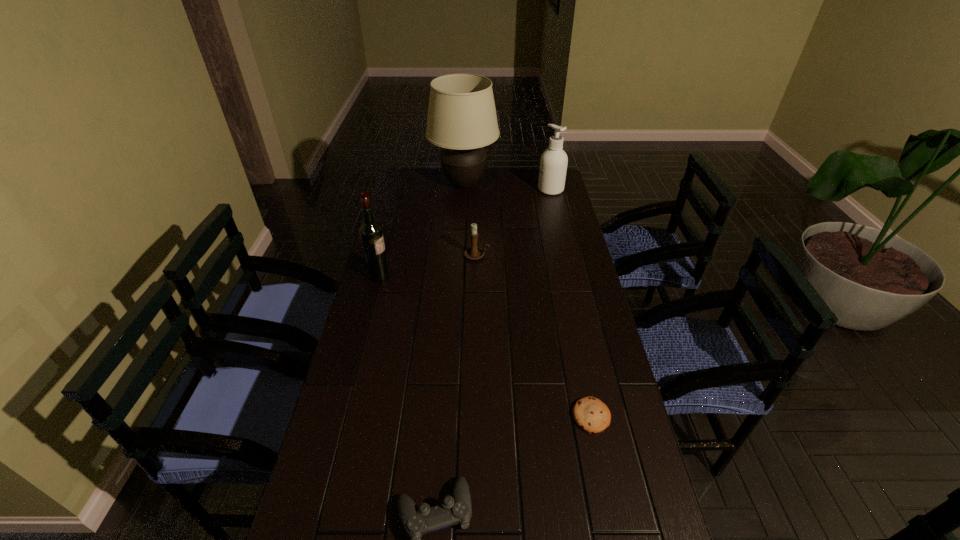
This screenshot has height=540, width=960. I want to click on the tallest object, so click(x=462, y=119).

Image resolution: width=960 pixels, height=540 pixels. Identify the location of the leftmost object. (371, 234).

Locate an element on the screen. wine bottle is located at coordinates (371, 234).

The image size is (960, 540). In order to click on cleansing agent in this screenshot , I will do `click(553, 165)`.

I want to click on the fourth nearest object, so click(473, 252).

Identify the location of the fourth tallest object. This screenshot has height=540, width=960. (473, 252).

What are the coordinates of `cookie` in the screenshot? It's located at (590, 414).

Where is `the second nearest object`? This screenshot has width=960, height=540. the second nearest object is located at coordinates (590, 414).

Locate an element on the screen. blank space located 0.090m on the right of the lampshade is located at coordinates (517, 184).

Where is `free region located 0.150m on the front and back of the fourth farthest object`? free region located 0.150m on the front and back of the fourth farthest object is located at coordinates (431, 276).